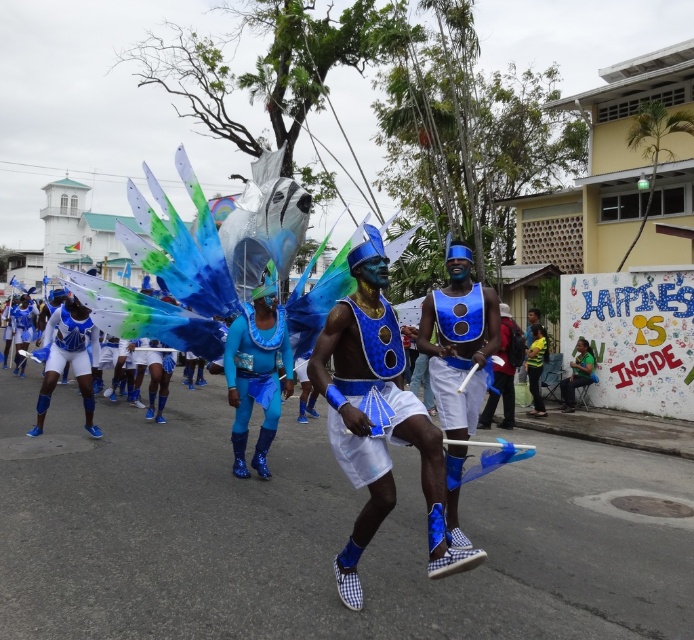
Which is in front, point (366, 412) or point (428, 298)?

Point (366, 412) is more forward.

Who is higher up, matte blue costume at center or matte blue fabric at center?

matte blue fabric at center is above.

Where is `matte blue costume at center`? matte blue costume at center is located at coordinates pyautogui.click(x=378, y=416).